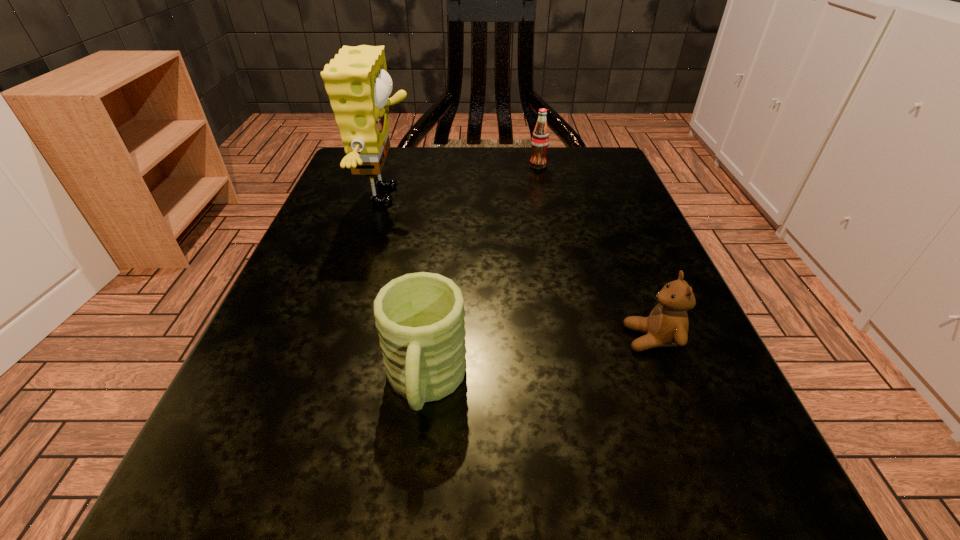
You are a GUI agent. You are given a task and a screenshot of the screen. Output one action in this format:
    pyautogui.click(x=<x>, y=<y>)
    Task: Click on the sponge
    The image size is (960, 540).
    Given the screenshot: What is the action you would take?
    pyautogui.click(x=356, y=80)

At what (x,y) coordinates should I click in order to perform the action: click on the leftmost object. Please return your answer as a coordinate pair (x, y). The width and height of the screenshot is (960, 540). Looking at the image, I should click on (356, 80).

Locate an element on the screen. This screenshot has width=960, height=540. soda is located at coordinates (540, 138).

Identify the location of the third object from right to left. (420, 316).

In order to click on the rightmost object in this screenshot , I will do `click(667, 325)`.

The image size is (960, 540). I want to click on teddy bear, so click(667, 325).

Find the location of a particular element. The width and height of the screenshot is (960, 540). vacant space situated 0.250m on the front-facing side of the sponge is located at coordinates (547, 195).

This screenshot has width=960, height=540. I want to click on vacant region located 0.380m on the front of the third object from left to right, so click(565, 294).

Find the location of a particular element. Image resolution: width=960 pixels, height=540 pixels. free spot located 0.080m on the side of the mug with the handle is located at coordinates (411, 521).

Image resolution: width=960 pixels, height=540 pixels. In order to click on vacant space located on the front-facing side of the rightmost object in this screenshot , I will do `click(380, 339)`.